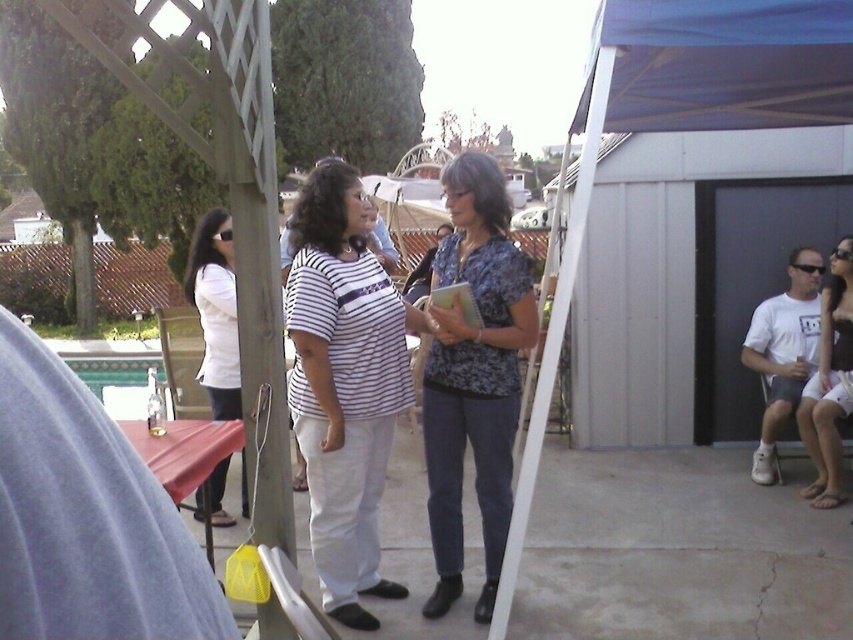
Question: Which of the following is the farthest from the observer?

Choices:
 (A) white matte shirt at left
 (B) white cotton shorts at lower right

Answer: (B)

Question: Is blue fabric canopy at upper right to the right of white cotton shorts at lower right from the viewer's perspective?

Choices:
 (A) no
 (B) yes

Answer: (A)

Question: Is blue printed blouse at center thinner than white cotton shorts at lower right?

Choices:
 (A) no
 (B) yes

Answer: (A)

Question: Can you confirm if blue printed blouse at center is smaller than white cotton shorts at lower right?

Choices:
 (A) no
 (B) yes

Answer: (A)

Question: Which point is closer to the camera taking this photo?

Choices:
 (A) (323, 282)
 (B) (805, 424)
 (C) (450, 328)
 (D) (845, 67)

Answer: (A)

Question: Based on their relative distances, which object is nearer to the white cotton shorts at lower right?

Choices:
 (A) blue fabric canopy at upper right
 (B) white matte shirt at left
 (C) white striped shirt at center
 (D) blue printed blouse at center

Answer: (A)